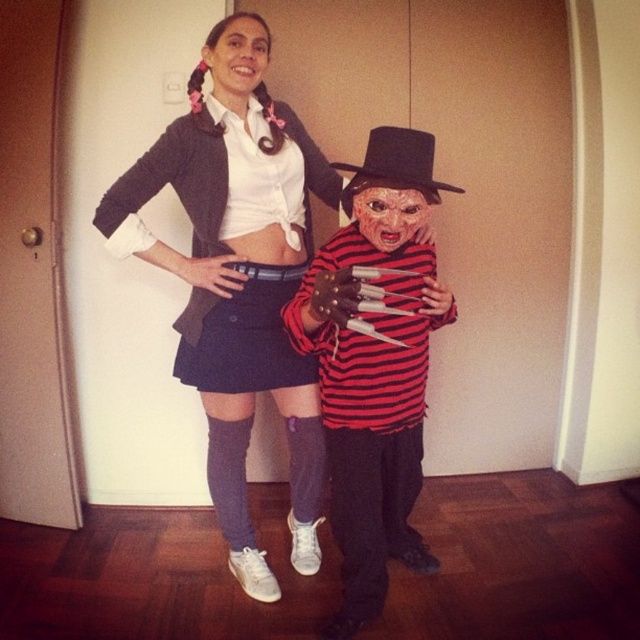
Can you confirm if red striped shirt at center is bigger than smooth plastic mask at center?

Correct, red striped shirt at center is larger in size than smooth plastic mask at center.

Does red striped shirt at center appear on the right side of smooth plastic mask at center?

Incorrect, red striped shirt at center is not on the right side of smooth plastic mask at center.

Does point (381, 172) lie in front of point (401, 224)?

That is True.

Find the location of `red striped shirt at center`. red striped shirt at center is located at coordinates (376, 364).

Which is above, red striped shirt at center or smooth skin face at upper center?

smooth skin face at upper center is higher up.

Does red striped shirt at center appear on the left side of smooth skin face at upper center?

No, red striped shirt at center is not to the left of smooth skin face at upper center.

This screenshot has height=640, width=640. What do you see at coordinates (376, 364) in the screenshot?
I see `red striped shirt at center` at bounding box center [376, 364].

Find the location of `red striped shirt at center`. red striped shirt at center is located at coordinates (376, 364).

Who is more distant from viewer, (176, 355) or (388, 476)?

The point (388, 476) is behind.

Does matte black jacket at upper center have a lesser width compared to red striped shirt at center?

No, matte black jacket at upper center is not thinner than red striped shirt at center.

What do you see at coordinates (237, 294) in the screenshot? This screenshot has height=640, width=640. I see `matte black jacket at upper center` at bounding box center [237, 294].

I want to click on matte black jacket at upper center, so click(237, 294).